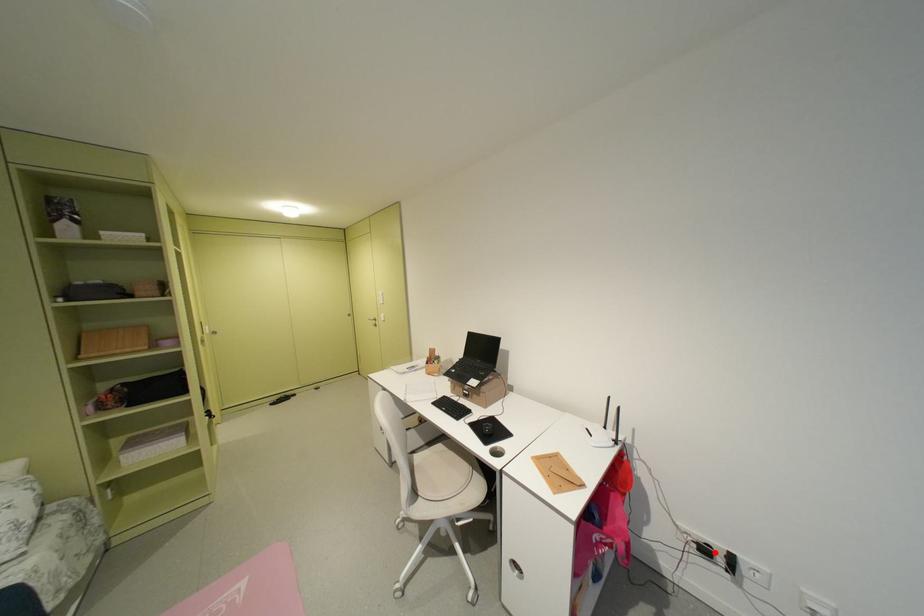
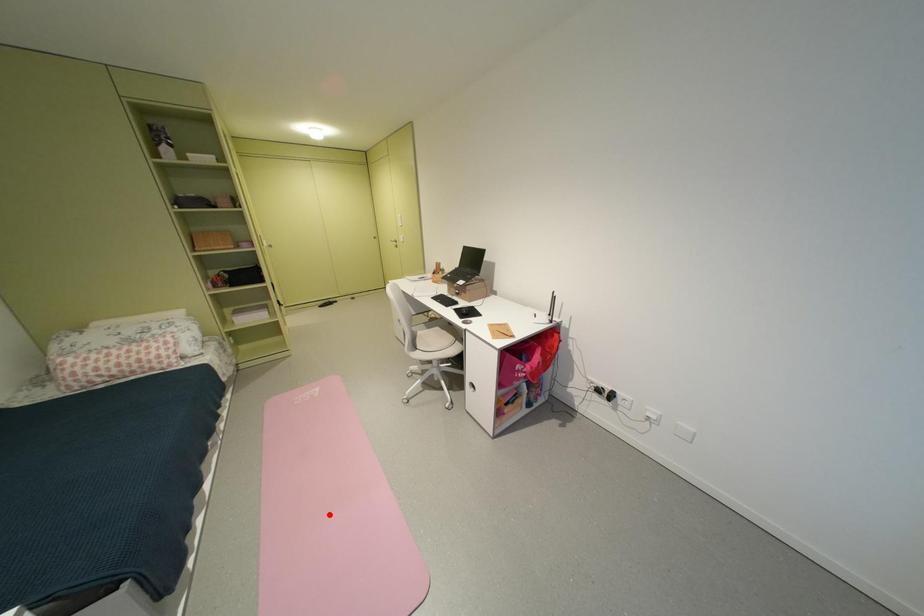
I am providing you with two images of the same scene from different viewpoints. A red point is marked on the first image and another point is marked on the second image. Is the red point in image1 aligned with the point shown in image2?

No